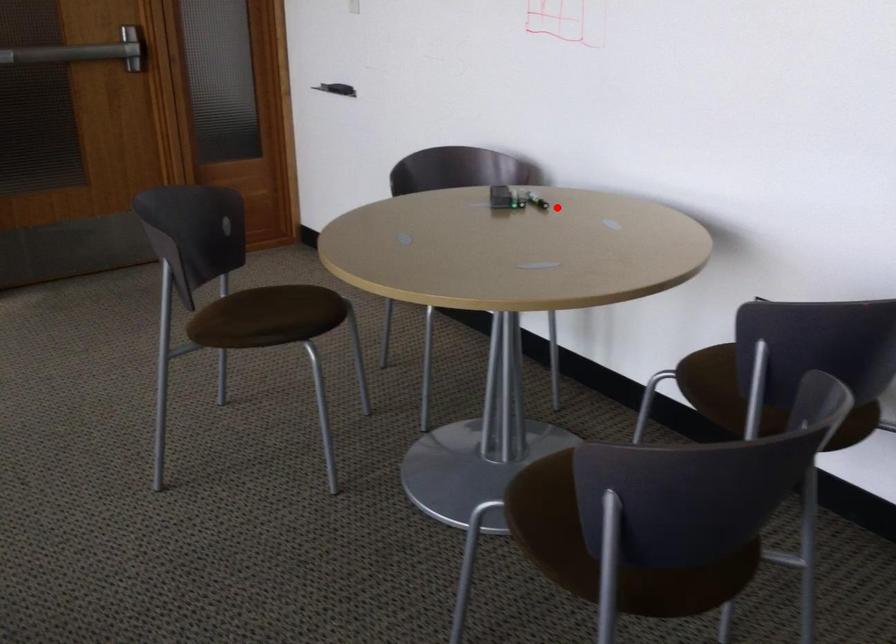
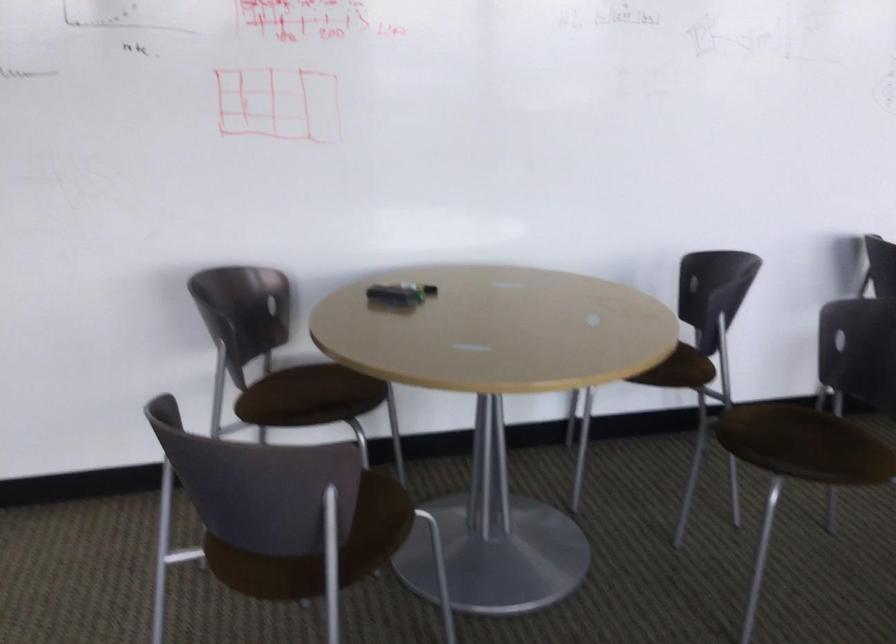
Find the pixel in the second image that matches the highlighted location in the first image.

(433, 290)